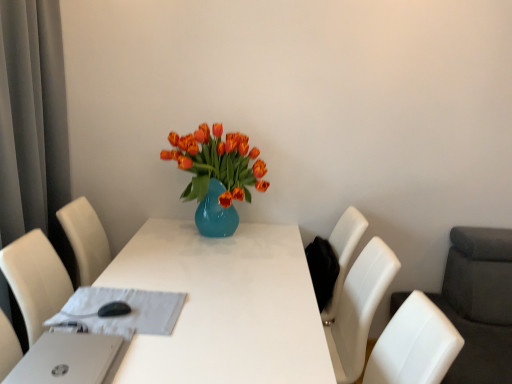
This screenshot has width=512, height=384. Find the location of `vacant space behind white fabric at center`. vacant space behind white fabric at center is located at coordinates (159, 274).